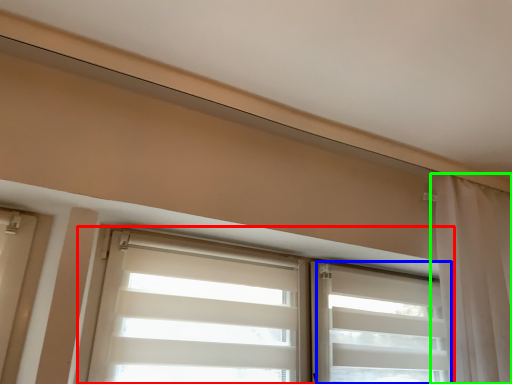
Question: Estimate the real-world distances between objects in this image. Which object is farther from window (highlighted by a red box), shutter (highlighted by a blue box) or curtain (highlighted by a green box)?

Choices:
 (A) shutter
 (B) curtain

Answer: (B)